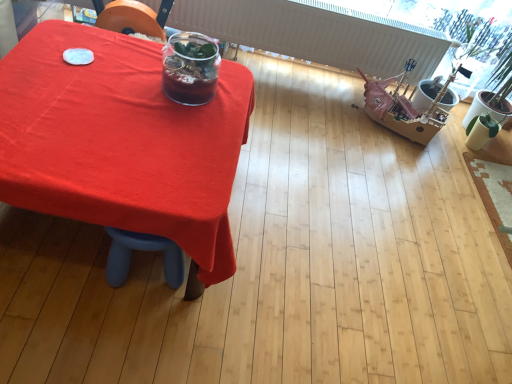
At what (x,y) coordinates should I click in order to perform the action: click on vacant area that is in front of translucent glass jar at center. Please return your answer as a coordinate pair (x, y). Looking at the image, I should click on (167, 119).